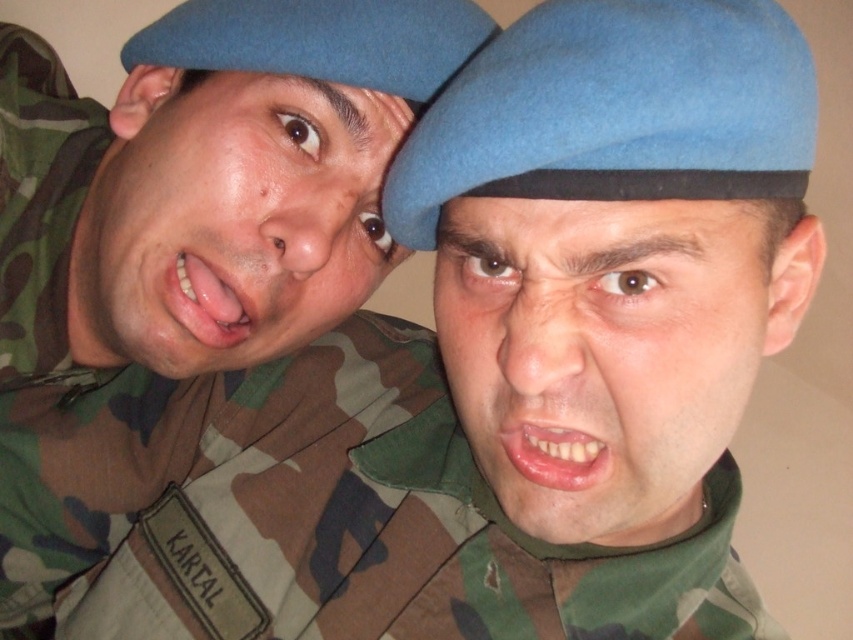
Based on the photo, you are a photographer trying to capture a clear shot of both the camo fabric uniform at left and the matte green face at center. Which object should you focus on first to ensure it appears sharp in the photo?

You should focus on the camo fabric uniform at left first because it is closer to you than the matte green face at center, so focusing on it will keep it sharp while the background might blur slightly.

You are a photographer trying to capture a group photo of the camo fabric uniform at left and the matte green face at center. If you want to ensure both subjects are in focus, which one should you adjust your camera focus on first?

The camo fabric uniform at left is bigger than the matte green face at center, so you should focus on the camo fabric uniform at left first to ensure both are in focus.

You are a photographer trying to capture a clear photo of the matte green face at center and the matte green uniform at left. Which one will appear closer to the camera in the photo?

The matte green face at center will appear closer to the camera in the photo because it is in front of the matte green uniform at left.